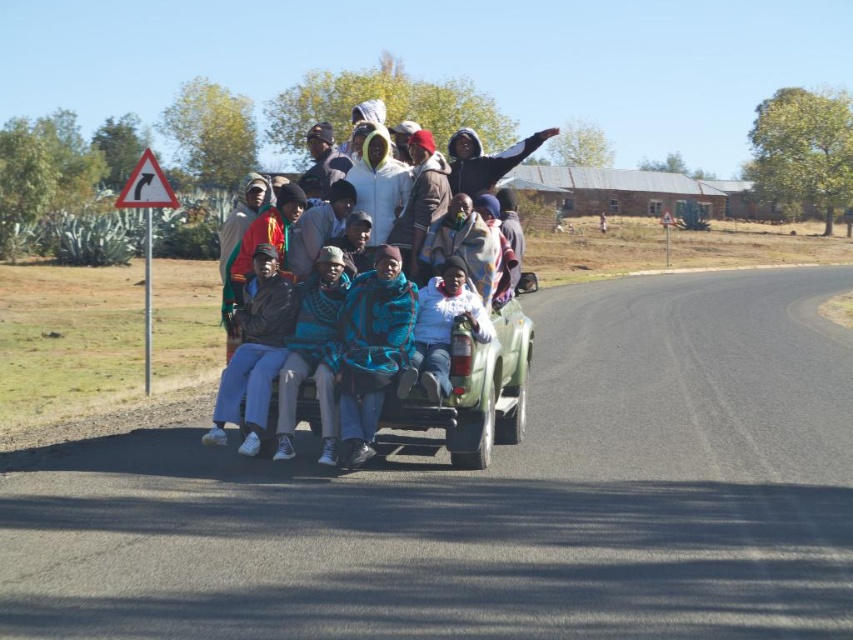
You are standing at the origin point of the image coordinate system, which is the bottom left corner. You want to place a GPS marker at the exact center of the multicolored woven blanket at center. What are the coordinates where you should place the GPS marker?

The coordinates for the exact center of the multicolored woven blanket at center are at point [437,269].